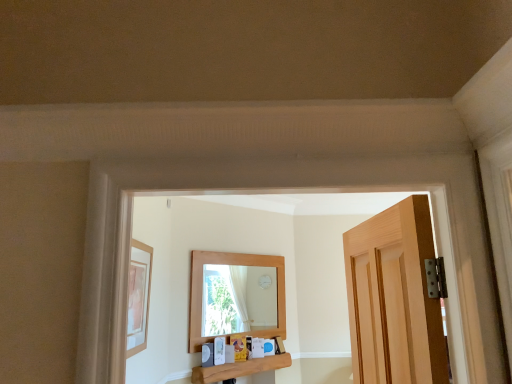
Describe the element at coordinates (138, 297) in the screenshot. I see `wooden picture frame at left` at that location.

Find the location of a particular element. This screenshot has height=384, width=512. wooden picture frame at left is located at coordinates (138, 297).

In order to click on wooden shelf at center in this screenshot , I will do `click(239, 369)`.

Describe the element at coordinates (239, 369) in the screenshot. The height and width of the screenshot is (384, 512). I see `wooden shelf at center` at that location.

What is the approximate width of wooden shelf at center?

14.26 centimeters.

I want to click on wooden picture frame at left, so click(x=138, y=297).

Is wooden picture frame at left at the left side of wooden shelf at center?

Yes, wooden picture frame at left is to the left of wooden shelf at center.

Consider the image. Is the depth of wooden picture frame at left greater than that of wooden shelf at center?

No, the depth of wooden picture frame at left is less than that of wooden shelf at center.

Which is less distant, (145, 322) or (214, 374)?

The point (145, 322) is in front.

From the image's perspective, is wooden picture frame at left located above wooden shelf at center?

Yes, from the image's perspective, wooden picture frame at left is above wooden shelf at center.

From a real-world perspective, is wooden picture frame at left below wooden shelf at center?

No, from a real-world perspective, wooden picture frame at left is not beneath wooden shelf at center.

Which of these two, wooden picture frame at left or wooden shelf at center, is wider?

Wider between the two is wooden shelf at center.

In the scene shown: Considering the sizes of objects wooden picture frame at left and wooden shelf at center in the image provided, who is shorter, wooden picture frame at left or wooden shelf at center?

With less height is wooden shelf at center.

Does wooden picture frame at left have a smaller size compared to wooden shelf at center?

Yes.

Is wooden picture frame at left positioned beyond the bounds of wooden shelf at center?

wooden picture frame at left lies outside wooden shelf at center's area.

Is wooden picture frame at left positioned far away from wooden shelf at center?

Yes, wooden picture frame at left is far from wooden shelf at center.

Could you tell me if wooden picture frame at left is facing wooden shelf at center?

No.

Can you tell me how much wooden picture frame at left and wooden shelf at center differ in facing direction?

45.1 degrees.

Identify the location of window sill below the wooden picture frame at left (from the image's perspective). (239, 369).

Considering the positions of objects wooden shelf at center and wooden picture frame at left in the image provided, who is more to the right, wooden shelf at center or wooden picture frame at left?

Positioned to the right is wooden shelf at center.

Which is behind, wooden shelf at center or wooden picture frame at left?

wooden shelf at center.

Is point (257, 370) positioned after point (151, 266)?

Yes, point (257, 370) is behind point (151, 266).

From the image's perspective, between wooden shelf at center and wooden picture frame at left, who is located below?

Result: wooden shelf at center.

From a real-world perspective, does wooden shelf at center stand above wooden picture frame at left?

No, from a real-world perspective, wooden shelf at center is not over wooden picture frame at left

Looking at their sizes, would you say wooden shelf at center is wider or thinner than wooden picture frame at left?

In the image, wooden shelf at center appears to be wider than wooden picture frame at left.

Is wooden shelf at center shorter than wooden picture frame at left?

Correct, wooden shelf at center is not as tall as wooden picture frame at left.

Which of these two, wooden shelf at center or wooden picture frame at left, is smaller?

With smaller size is wooden picture frame at left.

Would you say wooden picture frame at left is part of wooden shelf at center's contents?

No.

Are wooden shelf at center and wooden picture frame at left far apart?

wooden shelf at center is far away from wooden picture frame at left.

Is wooden shelf at center aimed at wooden picture frame at left?

No.

How far apart are wooden shelf at center and wooden picture frame at left?

wooden shelf at center is 1.40 meters from wooden picture frame at left.

I want to click on picture frame in front of the wooden shelf at center, so click(138, 297).

Where is `picture frame above the wooden shelf at center (from the image's perspective)`? Image resolution: width=512 pixels, height=384 pixels. picture frame above the wooden shelf at center (from the image's perspective) is located at coordinates (138, 297).

At what (x,y) coordinates should I click in order to perform the action: click on window sill that is on the right side of wooden picture frame at left. Please return your answer as a coordinate pair (x, y). The width and height of the screenshot is (512, 384). Looking at the image, I should click on (239, 369).